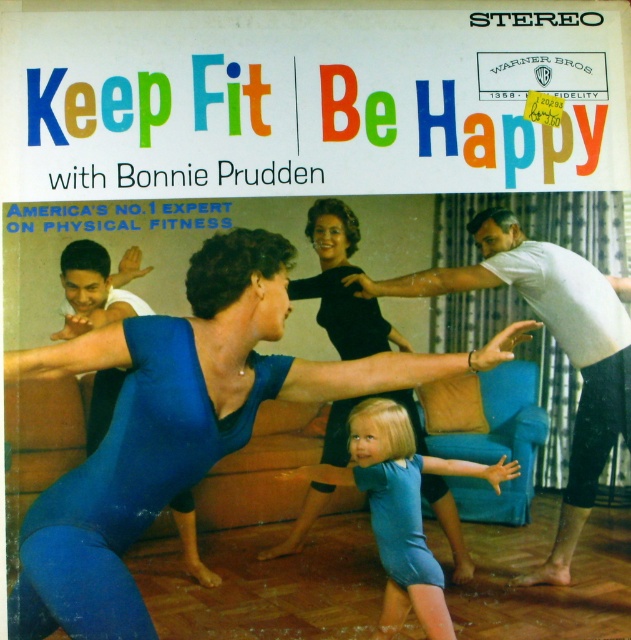
Can you confirm if blue spandex leotard at center is wider than blue fabric child at center?

Indeed, blue spandex leotard at center has a greater width compared to blue fabric child at center.

Can you confirm if blue spandex leotard at center is smaller than blue fabric child at center?

No.

Between point (329, 269) and point (215, 579), which one is positioned in front?

Positioned in front is point (215, 579).

Identify the location of blue spandex leotard at center. The height and width of the screenshot is (640, 631). (343, 285).

Who is lower down, blue denim shorts at center or blue fabric child at center?

blue denim shorts at center

Who is more distant from viewer, (410, 497) or (90, 428)?

Point (410, 497)

You are a GUI agent. You are given a task and a screenshot of the screen. Output one action in this format:
    pyautogui.click(x=<x>, y=<y>)
    Task: Click on the blue denim shorts at center
    The width and height of the screenshot is (631, 640).
    Given the screenshot: What is the action you would take?
    pyautogui.click(x=401, y=461)

Is blue spandex leotard at center wider than blue denim shorts at center?

Indeed, blue spandex leotard at center has a greater width compared to blue denim shorts at center.

At what (x,y) coordinates should I click in order to perform the action: click on blue spandex leotard at center. Please return your answer as a coordinate pair (x, y). Looking at the image, I should click on (343, 285).

Between point (327, 321) and point (410, 426), which one is positioned in front?

Point (327, 321) is more forward.

The height and width of the screenshot is (640, 631). Identify the location of blue spandex leotard at center. (343, 285).